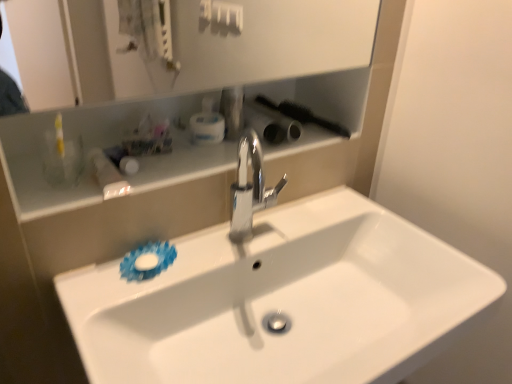
Identify the location of spots to the right of polished chrome faucet at center. (313, 221).